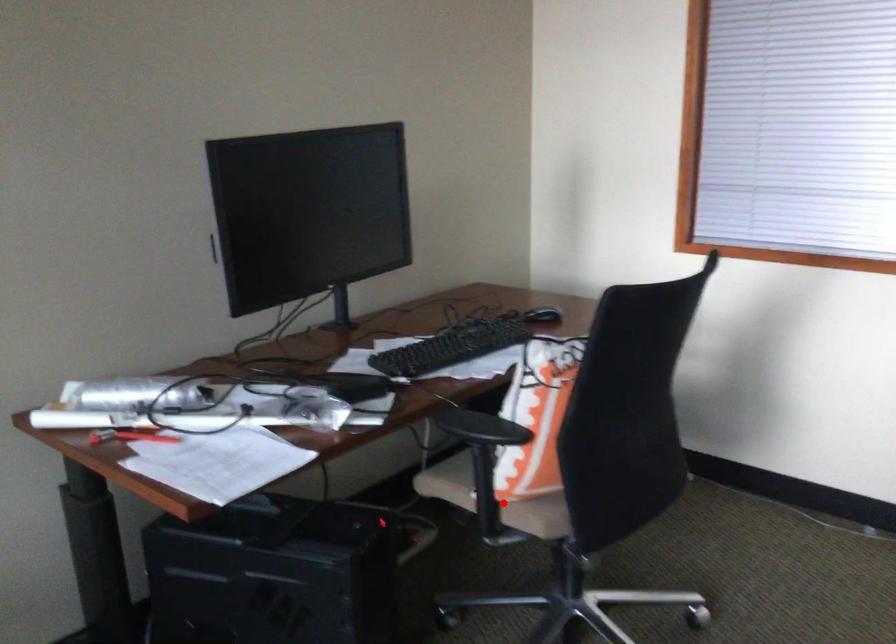
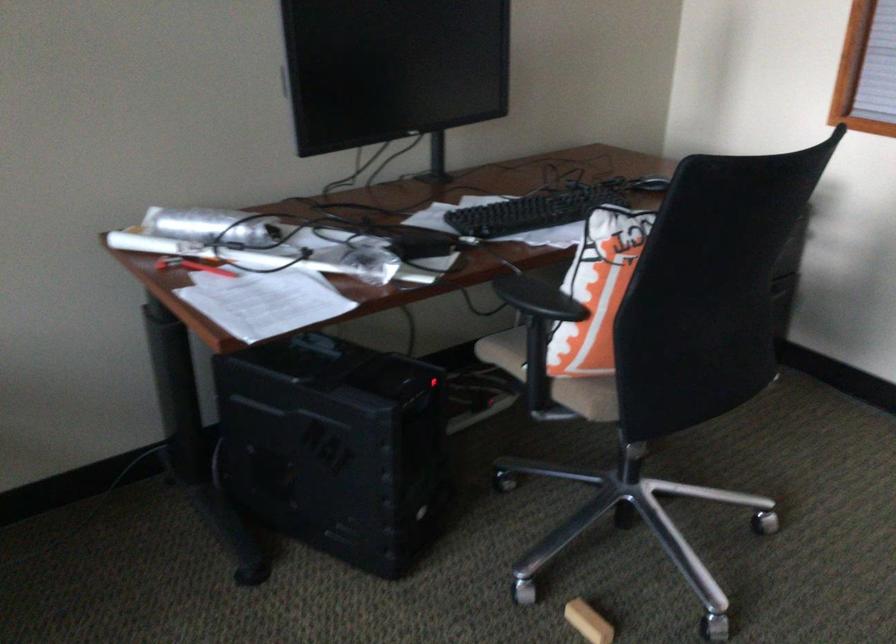
In the second image, find the point that corresponds to the highlighted location in the first image.

(552, 377)